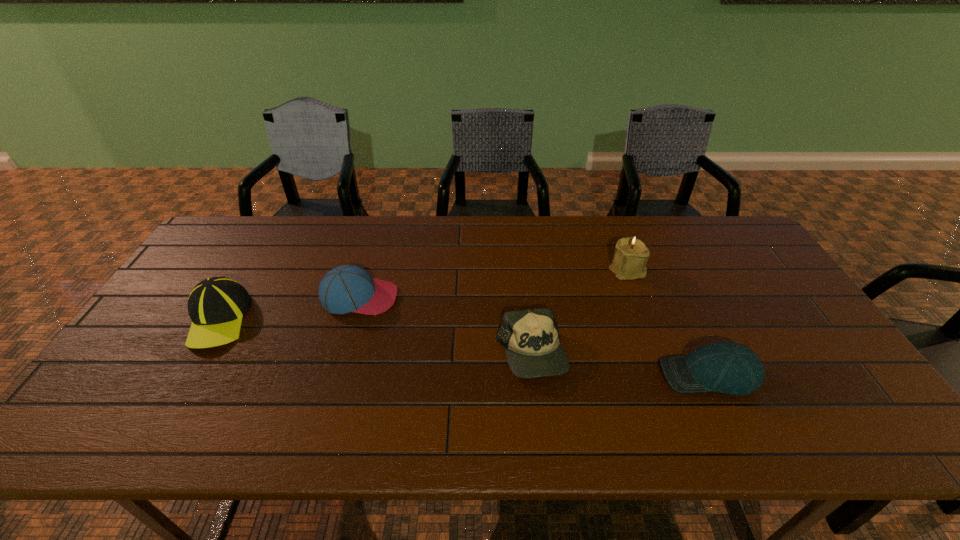
Identify the location of free space between the rightmost baseball cap and the leftmost object. This screenshot has height=540, width=960. coord(464,347).

Identify the location of empty space between the third baseball cap from left to right and the leftmost baseball cap. This screenshot has height=540, width=960. (374, 336).

The height and width of the screenshot is (540, 960). I want to click on free space between the second baseball cap from left to right and the second baseball cap from right to left, so click(445, 326).

Locate an element on the screen. vacant space that is in between the leftmost object and the third baseball cap from left to right is located at coordinates (374, 336).

Identify which object is the second closest to the third object from right to left. Please provide its 2D coordinates. Your answer should be formatted as a tuple, i.e. [(x, y)], where the tuple contains the x and y coordinates of a point satisfying the conditions above.

[(629, 261)]

Locate which object is the second closest to the second object from left to right. Please provide its 2D coordinates. Your answer should be formatted as a tuple, i.e. [(x, y)], where the tuple contains the x and y coordinates of a point satisfying the conditions above.

[(531, 338)]

Locate which baseball cap ranks second in proximity to the second baseball cap from left to right. Please provide its 2D coordinates. Your answer should be formatted as a tuple, i.e. [(x, y)], where the tuple contains the x and y coordinates of a point satisfying the conditions above.

[(531, 338)]

Select which baseball cap is the third closest to the tallest object. Please provide its 2D coordinates. Your answer should be formatted as a tuple, i.e. [(x, y)], where the tuple contains the x and y coordinates of a point satisfying the conditions above.

[(348, 288)]

The width and height of the screenshot is (960, 540). I want to click on free space that satisfies the following two spatial constraints: 1. on the front side of the rightmost baseball cap; 2. on the right side of the candle_holder, so click(666, 375).

The height and width of the screenshot is (540, 960). What are the coordinates of `free space that satisfies the following two spatial constraints: 1. on the front-facing side of the rightmost baseball cap; 2. on the left side of the third baseball cap from left to right` in the screenshot? It's located at (533, 375).